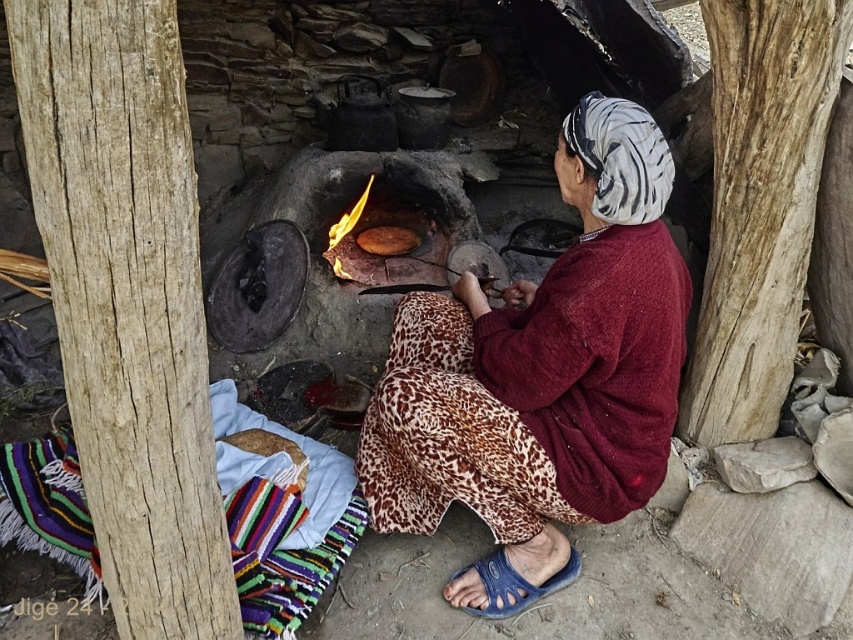
Does maroon knitted sweater at center have a lesser width compared to brown matte flatbread at center?

No.

Does point (506, 470) come in front of point (383, 232)?

Yes, it is in front of point (383, 232).

Locate an element on the screen. The image size is (853, 640). maroon knitted sweater at center is located at coordinates (541, 376).